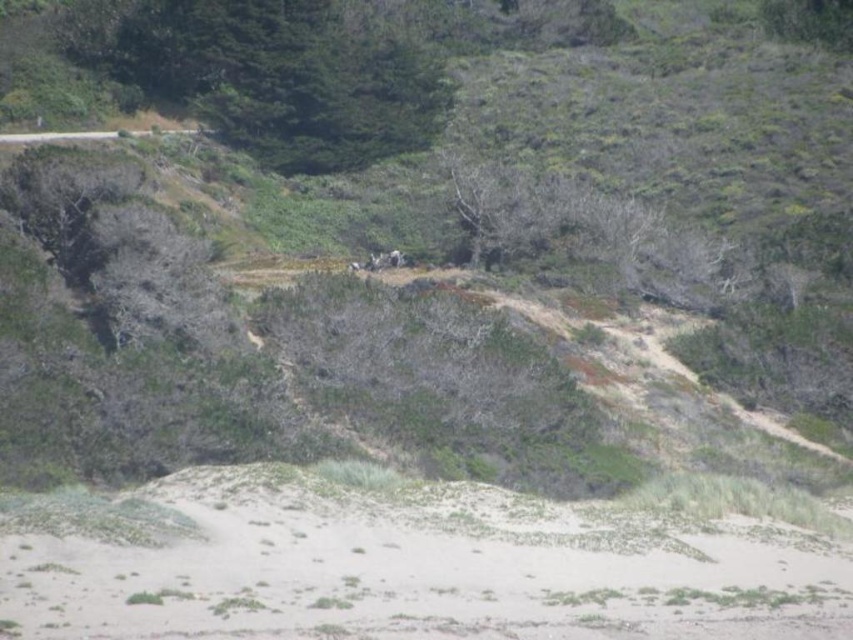
Question: Does white sandy beach at lower center have a larger size compared to green leafy tree at upper center?

Choices:
 (A) no
 (B) yes

Answer: (B)

Question: Which point is farther to the camera?

Choices:
 (A) (480, 499)
 (B) (300, 8)

Answer: (B)

Question: Does white sandy beach at lower center appear on the right side of green leafy tree at upper center?

Choices:
 (A) no
 (B) yes

Answer: (B)

Question: Which point appears closest to the camera in this image?

Choices:
 (A) (355, 566)
 (B) (265, 150)

Answer: (A)

Question: Which point is closer to the camera?

Choices:
 (A) (579, 534)
 (B) (283, 29)

Answer: (A)

Question: Can you confirm if white sandy beach at lower center is wider than green leafy tree at upper center?

Choices:
 (A) no
 (B) yes

Answer: (B)